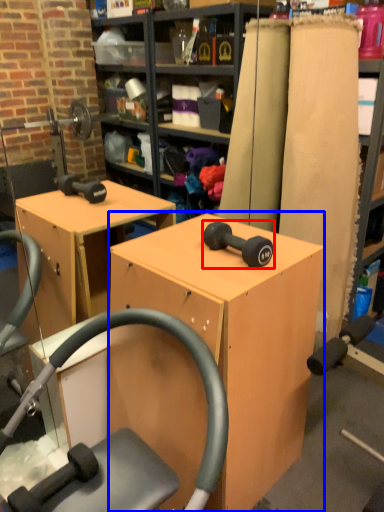
Question: Which object appears farthest to the camera in this image, dumbbell (highlighted by a red box) or furniture (highlighted by a blue box)?

Choices:
 (A) dumbbell
 (B) furniture

Answer: (A)